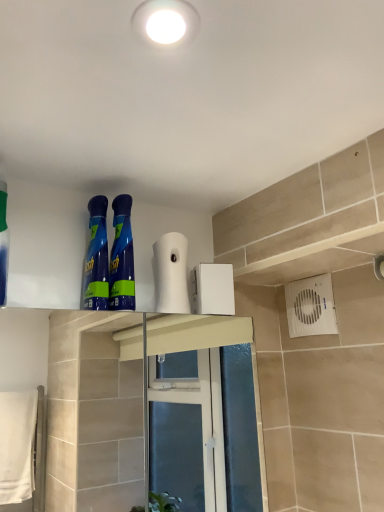
Question: From a real-world perspective, relative to blue glossy bottle at upper left, the second cleaning product positioned from the right, is blue glossy spray bottles at center, the third cleaning product positioned from the left, vertically above or below?

Choices:
 (A) below
 (B) above

Answer: (A)

Question: In terms of size, does blue glossy spray bottles at center, the third cleaning product positioned from the left, appear bigger or smaller than blue glossy bottle at upper left, arranged as the second cleaning product when viewed from the left?

Choices:
 (A) big
 (B) small

Answer: (A)

Question: Considering the real-world distances, which object is closest to the green matte bottle at left, acting as the third cleaning product starting from the right?

Choices:
 (A) white glossy light fixture at upper center
 (B) blue glossy spray bottles at center, the third cleaning product positioned from the left
 (C) white matte toilet paper at upper center
 (D) blue glossy bottle at upper left, arranged as the second cleaning product when viewed from the left

Answer: (D)

Question: Estimate the real-world distances between objects in this image. Which object is farther from the white glossy light fixture at upper center?

Choices:
 (A) blue glossy spray bottles at center, the third cleaning product positioned from the left
 (B) white matte toilet paper at upper center
 (C) green matte bottle at left, acting as the third cleaning product starting from the right
 (D) blue glossy bottle at upper left, the second cleaning product positioned from the right

Answer: (C)